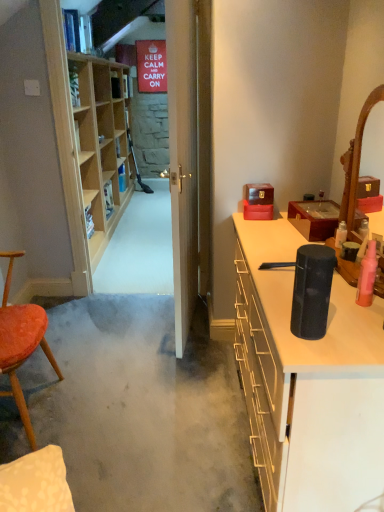
Describe the element at coordinates (314, 218) in the screenshot. The height and width of the screenshot is (512, 384). I see `wooden jewelry box at upper right, which appears as the first cabinetry when viewed from the top` at that location.

What is the approximate height of light wood shelf at left?

light wood shelf at left is 1.57 meters tall.

Describe the element at coordinates (101, 144) in the screenshot. The image size is (384, 512). I see `light wood shelf at left` at that location.

What do you see at coordinates (21, 343) in the screenshot? I see `velvet orange chair at left` at bounding box center [21, 343].

At what (x,y) coordinates should I click in order to perform the action: click on black matte speaker at right. Please return your answer as a coordinate pair (x, y). The image size is (384, 512). Looking at the image, I should click on (312, 290).

The image size is (384, 512). In order to click on chair behind the black matte speaker at right, the first cabinetry in the bottom-to-top sequence in this screenshot , I will do click(21, 343).

Based on the photo, is velvet orange chair at left to the left of black matte speaker at right, the second cabinetry positioned from the top, from the viewer's perspective?

Correct, you'll find velvet orange chair at left to the left of black matte speaker at right, the second cabinetry positioned from the top.

In terms of width, does velvet orange chair at left look wider or thinner when compared to black matte speaker at right, the second cabinetry positioned from the top?

Considering their sizes, velvet orange chair at left looks slimmer than black matte speaker at right, the second cabinetry positioned from the top.

Is velvet orange chair at left in front of or behind black matte speaker at right, the second cabinetry positioned from the top, in the image?

velvet orange chair at left is positioned farther from the viewer than black matte speaker at right, the second cabinetry positioned from the top.

Considering the positions of point (84, 168) and point (56, 373), is point (84, 168) closer or farther from the camera than point (56, 373)?

Point (84, 168) is farther from the camera than point (56, 373).

Is light wood shelf at left behind velvet orange chair at left?

Yes, it is behind velvet orange chair at left.

From a real-world perspective, is light wood shelf at left beneath velvet orange chair at left?

No, from a real-world perspective, light wood shelf at left is not under velvet orange chair at left.

Is white wooden door at center positioned with its back to black matte speaker at right, the second cabinetry positioned from the top?

No, white wooden door at center is not facing the opposite direction of black matte speaker at right, the second cabinetry positioned from the top.

Where is `door that is behind the black matte speaker at right, the first cabinetry in the bottom-to-top sequence`? Image resolution: width=384 pixels, height=512 pixels. door that is behind the black matte speaker at right, the first cabinetry in the bottom-to-top sequence is located at coordinates (183, 159).

Consider the image. Is wooden mirror at right positioned with its back to black matte speaker at right, the first cabinetry in the bottom-to-top sequence?

wooden mirror at right does not have its back to black matte speaker at right, the first cabinetry in the bottom-to-top sequence.

Between point (354, 204) and point (350, 392), which one is positioned in front?

Positioned in front is point (350, 392).

Is wooden mirror at right with black matte speaker at right, the first cabinetry in the bottom-to-top sequence?

No, wooden mirror at right is not with black matte speaker at right, the first cabinetry in the bottom-to-top sequence.

From a real-world perspective, who is located lower, velvet orange chair at left or wooden jewelry box at upper right, the second cabinetry positioned from the bottom?

velvet orange chair at left.

From the image's perspective, which object appears higher, velvet orange chair at left or wooden jewelry box at upper right, which appears as the first cabinetry when viewed from the top?

wooden jewelry box at upper right, which appears as the first cabinetry when viewed from the top, appears higher in the image.

Is velvet orange chair at left positioned beyond the bounds of wooden jewelry box at upper right, the second cabinetry positioned from the bottom?

That's correct, velvet orange chair at left is outside of wooden jewelry box at upper right, the second cabinetry positioned from the bottom.

Is velvet orange chair at left further to camera compared to wooden jewelry box at upper right, which appears as the first cabinetry when viewed from the top?

No, velvet orange chair at left is closer to the viewer.

Who is more distant, white wooden door at center or pink matte bottle at right?

white wooden door at center is more distant.

From the image's perspective, relative to pink matte bottle at right, is white wooden door at center above or below?

Clearly, from the image's perspective, white wooden door at center is above pink matte bottle at right.

You are a GUI agent. You are given a task and a screenshot of the screen. Output one action in this format:
    pyautogui.click(x=<x>, y=<y>)
    Task: Click on the door that is on the left side of pink matte bottle at right
    
    Given the screenshot: What is the action you would take?
    click(x=183, y=159)

Which is farther from the camera, (176, 242) or (371, 272)?

The point (176, 242) is farther from the camera.

Which object is thinner, black matte speaker at right, the first cabinetry in the bottom-to-top sequence, or white wooden door at center?

Thinner between the two is white wooden door at center.

How far apart are black matte speaker at right, the first cabinetry in the bottom-to-top sequence, and white wooden door at center?

black matte speaker at right, the first cabinetry in the bottom-to-top sequence, is 34.11 inches away from white wooden door at center.

Considering the relative positions of black matte speaker at right, the second cabinetry positioned from the top, and white wooden door at center in the image provided, is black matte speaker at right, the second cabinetry positioned from the top, behind white wooden door at center?

No, black matte speaker at right, the second cabinetry positioned from the top, is closer to the camera.

Between black matte speaker at right, the second cabinetry positioned from the top, and white wooden door at center, which one has less height?

With less height is black matte speaker at right, the second cabinetry positioned from the top.

Identify the location of chair on the left of black matte speaker at right, the first cabinetry in the bottom-to-top sequence. 21,343.

I want to click on chair located on the right of light wood shelf at left, so click(x=21, y=343).

Considering their positions, is light wood shelf at left positioned further to velvet orange chair at left than black matte speaker at right?

light wood shelf at left is positioned further to the anchor velvet orange chair at left.

Estimate the real-world distances between objects in this image. Which object is closer to wooden mirror at right, light wood shelf at left or black matte speaker at right, the second cabinetry positioned from the top?

black matte speaker at right, the second cabinetry positioned from the top, is closer to wooden mirror at right.

From the image, which object appears to be farther from velvet orange chair at left, wooden mirror at right or pink matte bottle at right?

wooden mirror at right lies further to velvet orange chair at left than the other object.

Considering their positions, is wooden mirror at right positioned further to velvet orange chair at left than black matte speaker at right?

wooden mirror at right is further to velvet orange chair at left.

From the picture: Looking at the image, which one is located further to white wooden door at center, light wood shelf at left or wooden mirror at right?

light wood shelf at left is further to white wooden door at center.

In the scene shown: Estimate the real-world distances between objects in this image. Which object is closer to velvet orange chair at left, wooden mirror at right or light wood shelf at left?

Based on the image, wooden mirror at right appears to be nearer to velvet orange chair at left.

Estimate the real-world distances between objects in this image. Which object is further from wooden jewelry box at upper right, the second cabinetry positioned from the bottom, black matte speaker at right or white wooden door at center?

black matte speaker at right.

When comparing their distances from black matte speaker at right, does wooden jewelry box at upper right, the second cabinetry positioned from the bottom, or wooden mirror at right seem closer?

wooden mirror at right lies closer to black matte speaker at right than the other object.

The width and height of the screenshot is (384, 512). What are the coordinates of `mirror located between velvet orange chair at left and wooden jewelry box at upper right, the second cabinetry positioned from the bottom, in the left-right direction` in the screenshot? It's located at (356, 165).

The width and height of the screenshot is (384, 512). In order to click on toiletry located between black matte speaker at right, the first cabinetry in the bottom-to-top sequence, and wooden jewelry box at upper right, which appears as the first cabinetry when viewed from the top, in the depth direction in this screenshot , I will do `click(367, 276)`.

What are the coordinates of `toiletry situated between white wooden door at center and wooden jewelry box at upper right, the second cabinetry positioned from the bottom, from left to right` in the screenshot? It's located at (367, 276).

Identify the location of mirror between black matte speaker at right and white wooden door at center from front to back. (356, 165).